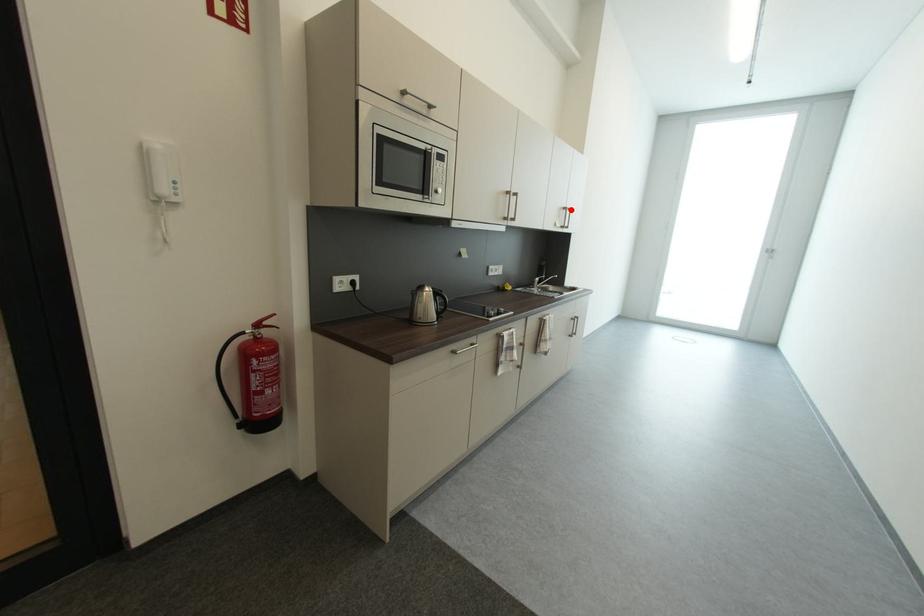
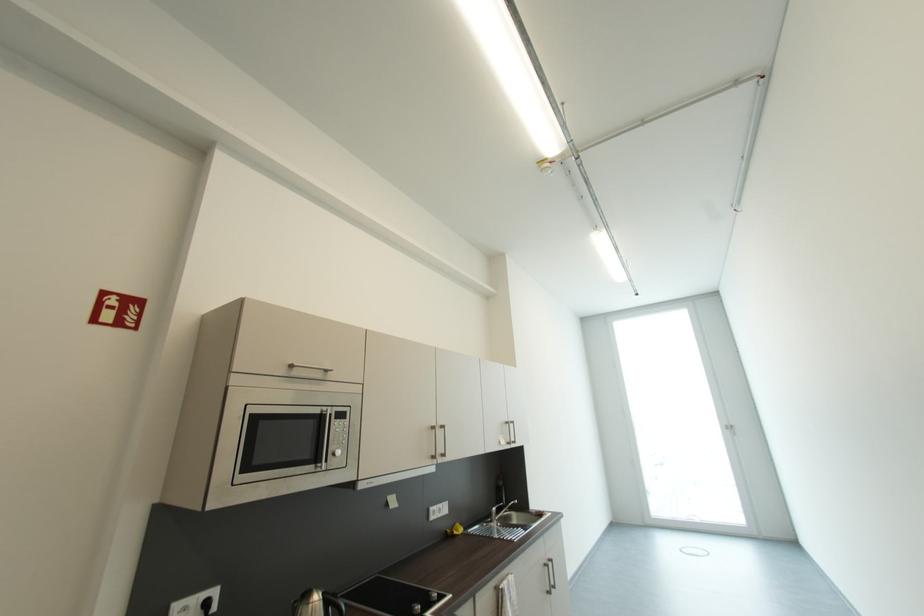
Question: I am providing you with two images of the same scene from different viewpoints. Image1 has a red point marked. In image2, the corresponding 3D location appears at what relative position? Reply with the corresponding letter.

Choices:
 (A) Closer
 (B) Farther

Answer: (B)